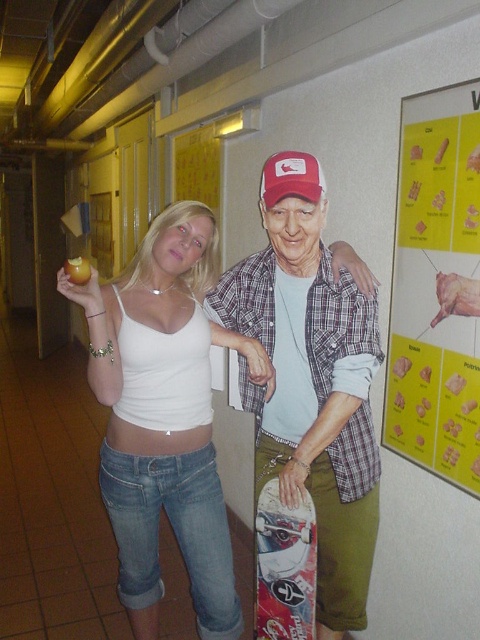
Question: In this image, where is plaid fabric shirt at center located relative to matte red baseball cap at upper center?

Choices:
 (A) below
 (B) above

Answer: (A)

Question: Among these objects, which one is nearest to the camera?

Choices:
 (A) white matte tank top at center
 (B) plaid fabric shirt at center
 (C) matte red baseball cap at upper center
 (D) yellow paper poster at upper right

Answer: (C)

Question: Estimate the real-world distances between objects in this image. Which object is farther from the matte red baseball cap at upper center?

Choices:
 (A) white matte tank top at center
 (B) white glossy skateboard at lower center
 (C) plaid fabric shirt at center

Answer: (B)

Question: Which object is positioned farthest from the plaid fabric shirt at center?

Choices:
 (A) white glossy skateboard at lower center
 (B) matte red baseball cap at upper center

Answer: (B)

Question: Can you confirm if white matte tank top at center is positioned to the left of matte red baseball cap at upper center?

Choices:
 (A) no
 (B) yes

Answer: (B)

Question: Is white glossy skateboard at lower center wider than matte red baseball cap at upper center?

Choices:
 (A) no
 (B) yes

Answer: (A)